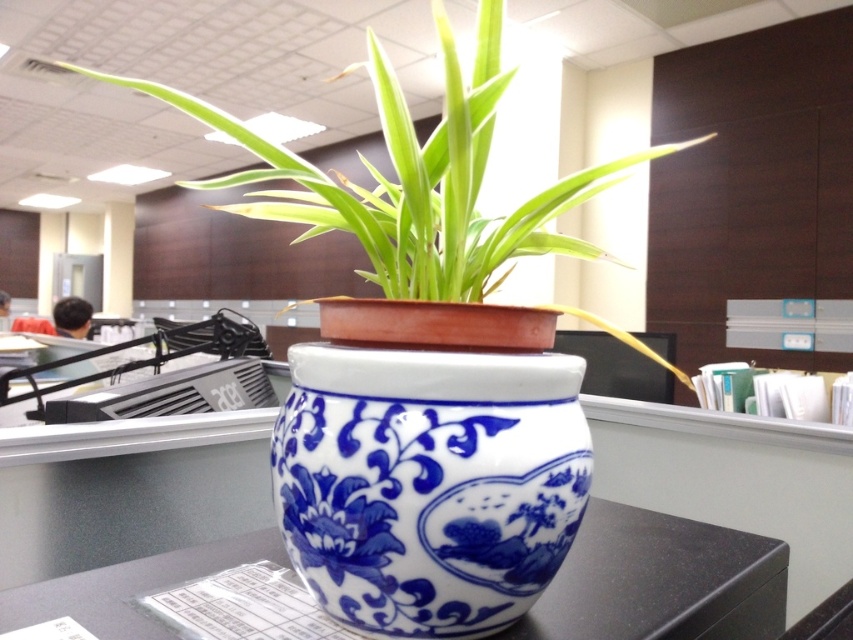
Question: Estimate the real-world distances between objects in this image. Which object is closer to the white glossy table at center?

Choices:
 (A) blue and white ceramic pot at center
 (B) blue porcelain vase at center

Answer: (B)

Question: Does blue porcelain vase at center appear over white glossy table at center?

Choices:
 (A) no
 (B) yes

Answer: (B)

Question: Which is farther from the white glossy table at center?

Choices:
 (A) blue porcelain vase at center
 (B) blue and white ceramic pot at center

Answer: (B)

Question: Does blue and white ceramic pot at center have a greater width compared to white glossy table at center?

Choices:
 (A) yes
 (B) no

Answer: (A)

Question: Which point is closer to the camera taking this photo?

Choices:
 (A) (431, 456)
 (B) (62, 584)

Answer: (A)

Question: Where is blue porcelain vase at center located in relation to blue and white ceramic pot at center in the image?

Choices:
 (A) below
 (B) above

Answer: (A)